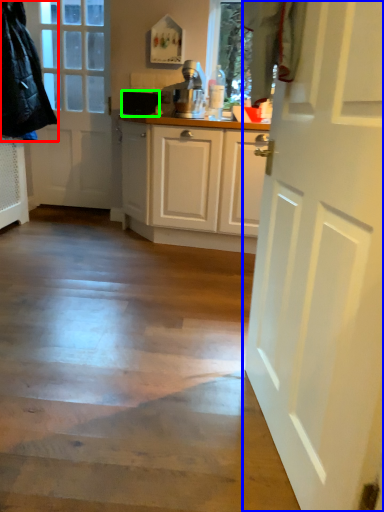
Question: Considering the real-world distances, which object is farthest from jacket (highlighted by a red box)? door (highlighted by a blue box) or appliance (highlighted by a green box)?

Choices:
 (A) door
 (B) appliance

Answer: (A)